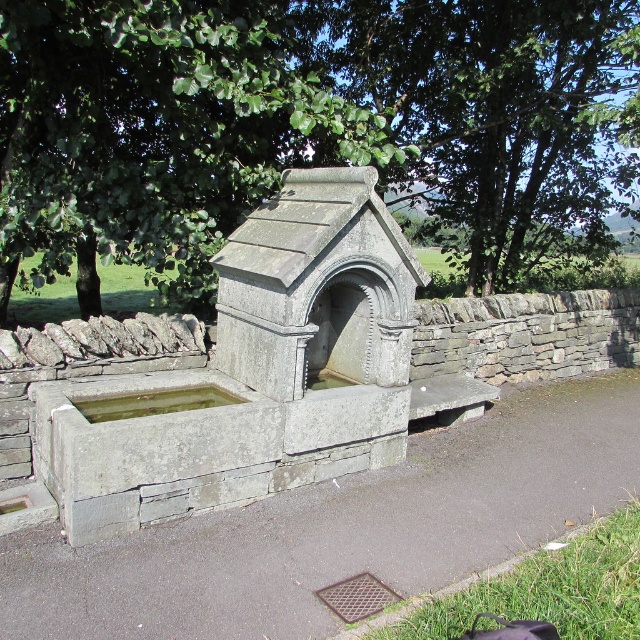
Between point (278, 134) and point (474, 234), which one is positioned in front?

Positioned in front is point (278, 134).

What do you see at coordinates (157, 132) in the screenshot? I see `green leafy tree at upper left` at bounding box center [157, 132].

Describe the element at coordinates (157, 132) in the screenshot. I see `green leafy tree at upper left` at that location.

Image resolution: width=640 pixels, height=640 pixels. What are the coordinates of `green leafy tree at upper left` in the screenshot? It's located at (157, 132).

Locate an element on the screen. This screenshot has height=640, width=640. gray stone trough at center is located at coordinates point(340,529).

Is point (198, 525) positioned in front of point (84, 410)?

Yes.

The width and height of the screenshot is (640, 640). What are the coordinates of `gray stone trough at center` in the screenshot? It's located at (340, 529).

Does green leafy tree at upper center appear over green stone trough at center?

Yes.

Between point (586, 259) and point (129, 412), which one is positioned behind?

Point (586, 259)

This screenshot has width=640, height=640. Identify the location of green leafy tree at upper center. (497, 116).